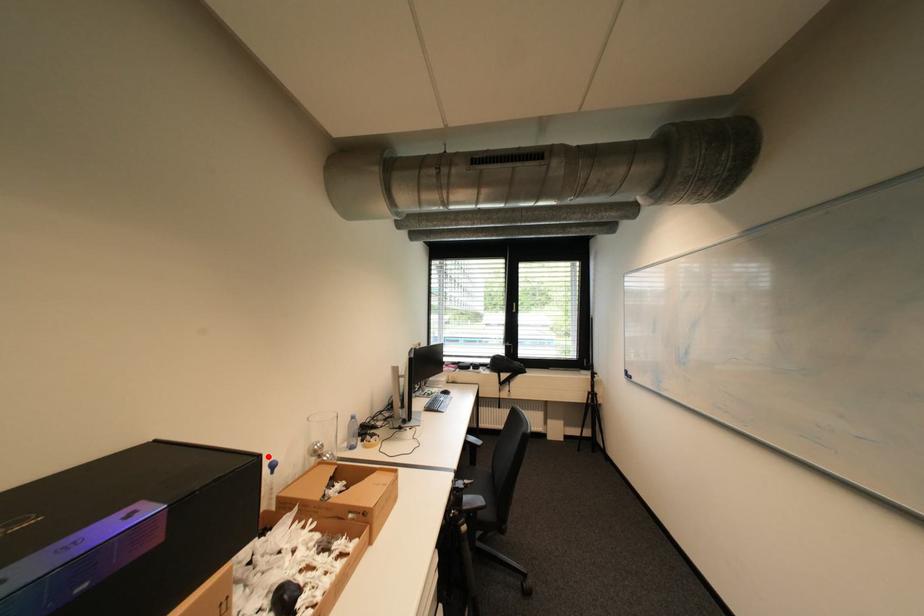
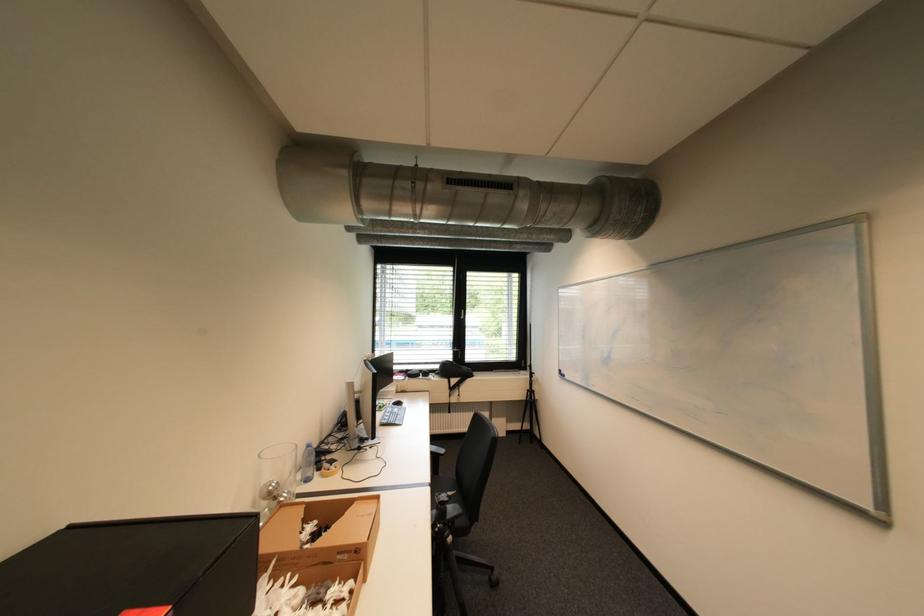
The point at the highlighted location is marked in the first image. Where is the corresponding point in the second image?

(265, 516)